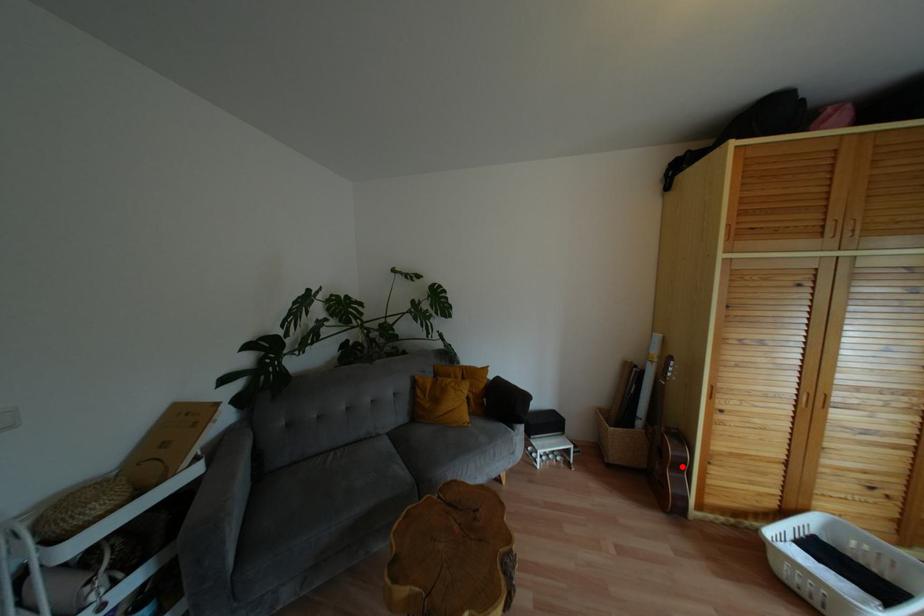
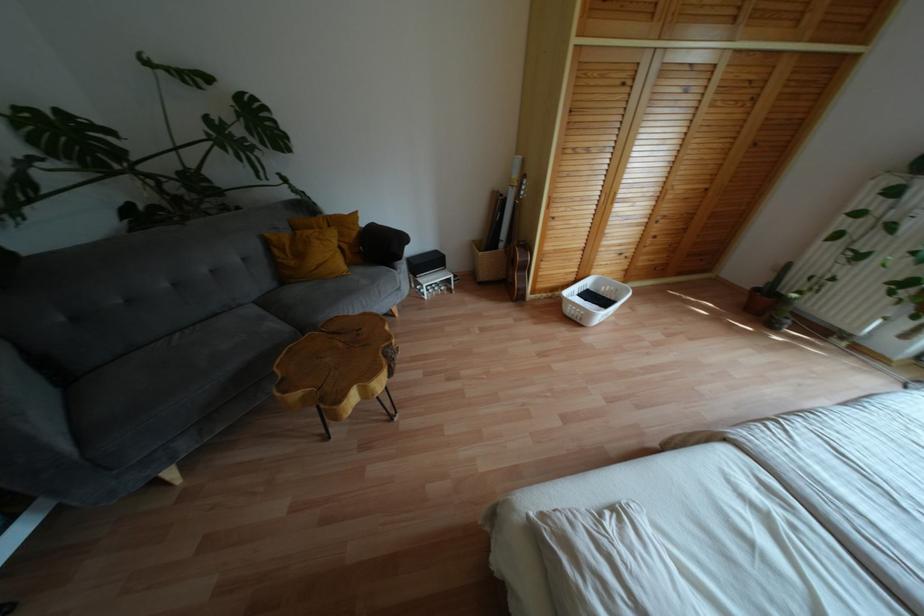
Question: A red point is marked in image1. In image2, is the corresponding 3D point closer to the camera or farther? Reply with the corresponding letter.

Choices:
 (A) The corresponding 3D point is closer.
 (B) The corresponding 3D point is farther.

Answer: (B)